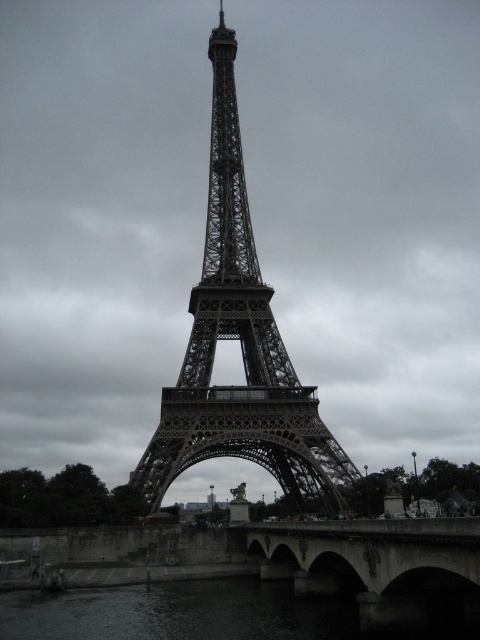
You are standing at the coordinates 0.5, 0.5 in the image. Which direction should you move to get closer to the metallic lattice tower at center?

The metallic lattice tower at center is located at point (240, 348). Since you are at (240, 320), you should move northeast to reach it.

You are standing at the base of the Eiffel Tower and see two points marked in the scene. Which point is closer to you, point (317,632) or point (311,560)?

Point (317,632) is closer to the viewer than point (311,560).

You are a tourist standing on the concrete bridge at lower center and want to cross to the other side. Given that the dark water at lower center is wider than the bridge, can you safely walk across the bridge without getting wet?

The dark water at lower center is wider than the concrete bridge at lower center, so the bridge may not span the entire width of the water. There might be a gap, so it might not be safe to walk across without getting wet.